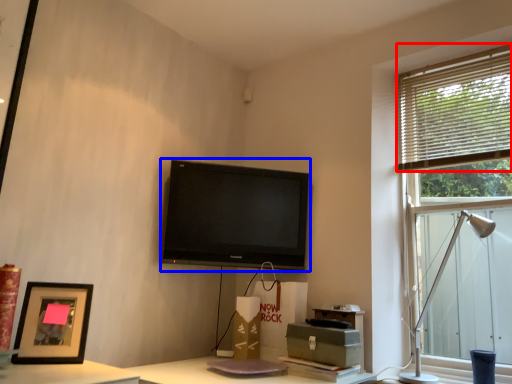
Question: Which point is closer to the camera, blind (highlighted by a red box) or television (highlighted by a blue box)?

Choices:
 (A) blind
 (B) television

Answer: (A)